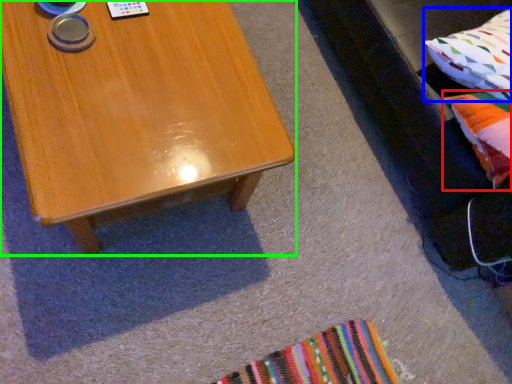
Question: Which is nearer to the pillow (highlighted by a red box)? pillow (highlighted by a blue box) or coffee table (highlighted by a green box).

Choices:
 (A) pillow
 (B) coffee table

Answer: (A)